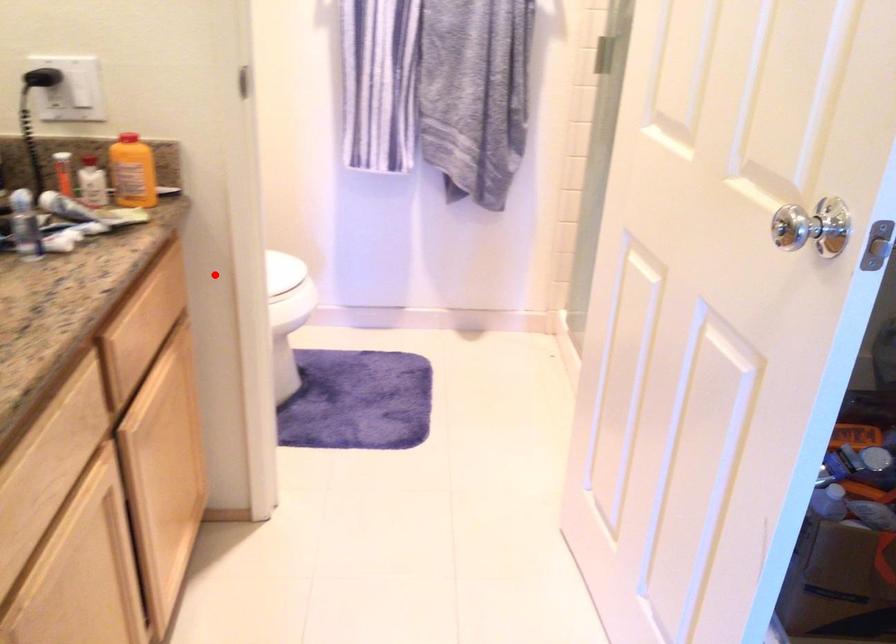
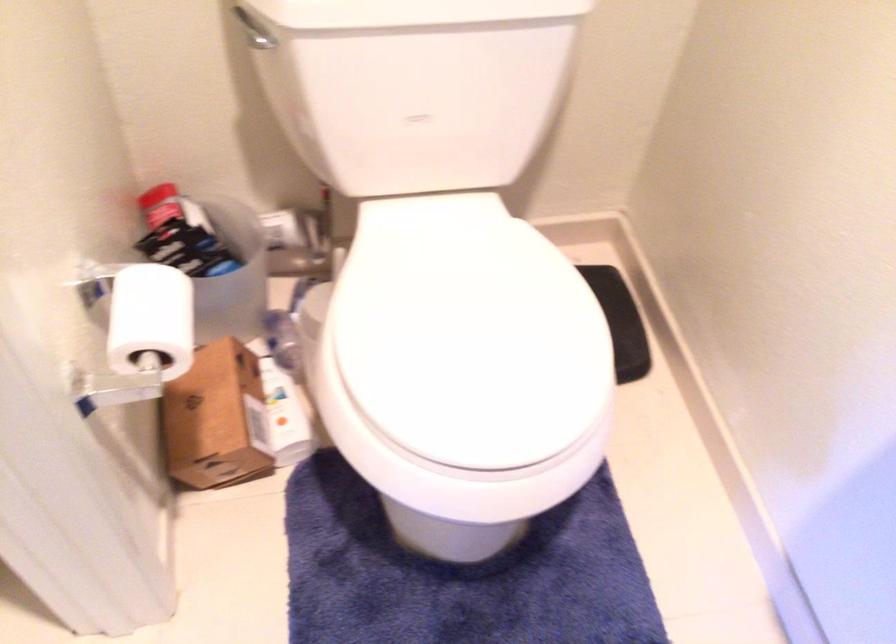
Question: I am providing you with two images of the same scene from different viewpoints. Image1 has a red point marked. In image2, the corresponding 3D location appears at what relative position? Reply with the corresponding letter.

Choices:
 (A) Closer
 (B) Farther

Answer: (A)